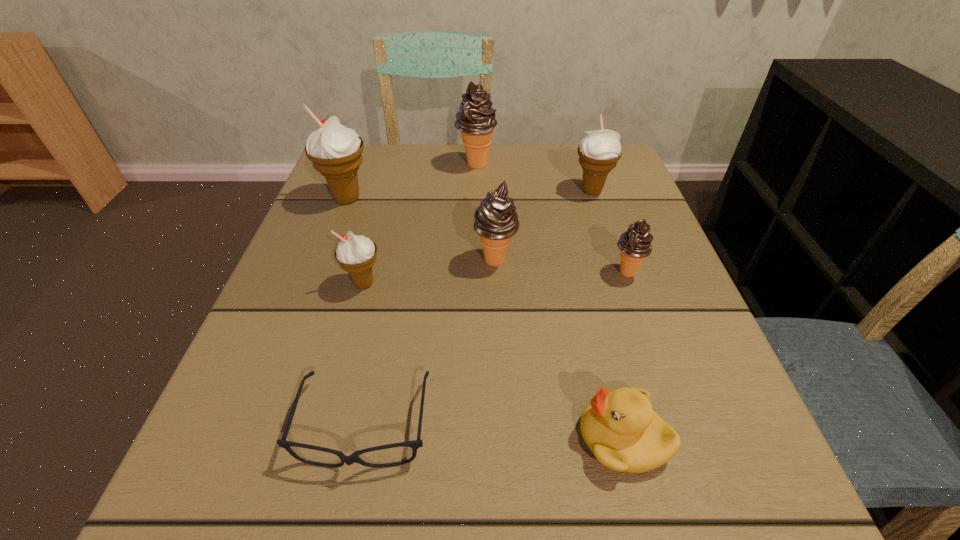
Where is `vacant space that satisfies the following two spatial constraints: 1. on the back side of the biggest white icecream; 2. on the left side of the farthest object`? The width and height of the screenshot is (960, 540). vacant space that satisfies the following two spatial constraints: 1. on the back side of the biggest white icecream; 2. on the left side of the farthest object is located at coordinates (360, 165).

You are a GUI agent. You are given a task and a screenshot of the screen. Output one action in this format:
    pyautogui.click(x=<x>, y=<y>)
    Task: Click on the vacant space that satisfies the following two spatial constraints: 1. on the back side of the second smallest chocolate icecream; 2. on the right side of the nearest white icecream
    
    Given the screenshot: What is the action you would take?
    pyautogui.click(x=371, y=260)